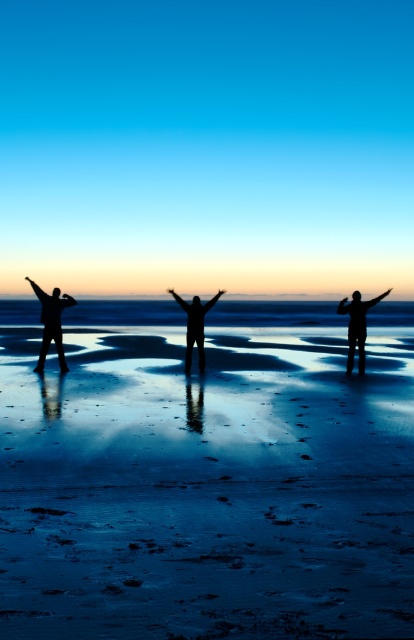
Question: Is sandy beach at center closer to the viewer compared to silhouette figure at left?

Choices:
 (A) yes
 (B) no

Answer: (A)

Question: Is silhouette figure at right wider than black matte arm at upper right?

Choices:
 (A) no
 (B) yes

Answer: (A)

Question: Can you confirm if black matte arm at center is positioned to the right of black matte arm at upper right?

Choices:
 (A) yes
 (B) no

Answer: (B)

Question: Which of the following is the farthest from the observer?

Choices:
 (A) (197, 339)
 (B) (375, 301)
 (C) (74, 300)
 (D) (40, 292)

Answer: (D)

Question: Among these objects, which one is nearest to the camera?

Choices:
 (A) black matte arm at upper right
 (B) silhouette figure at left

Answer: (B)

Question: Which of the following is the closest to the observer?

Choices:
 (A) (363, 349)
 (B) (187, 371)
 (C) (43, 291)

Answer: (A)